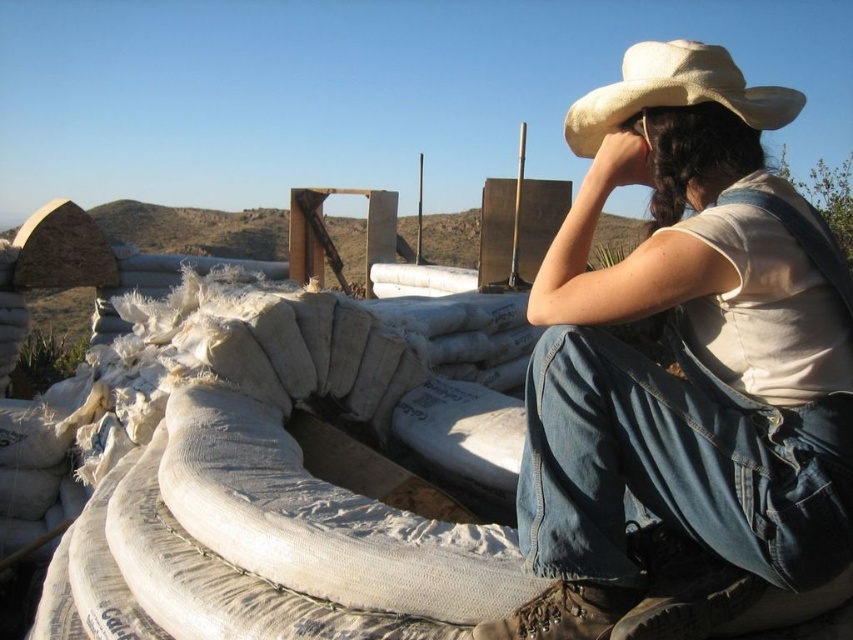
Does white denim overalls at upper right lie behind beige fabric cowboy hat at upper right?

No, it is not.

Does white denim overalls at upper right appear over beige fabric cowboy hat at upper right?

No, white denim overalls at upper right is not above beige fabric cowboy hat at upper right.

What do you see at coordinates (682, 355) in the screenshot? I see `white denim overalls at upper right` at bounding box center [682, 355].

This screenshot has width=853, height=640. I want to click on white denim overalls at upper right, so click(682, 355).